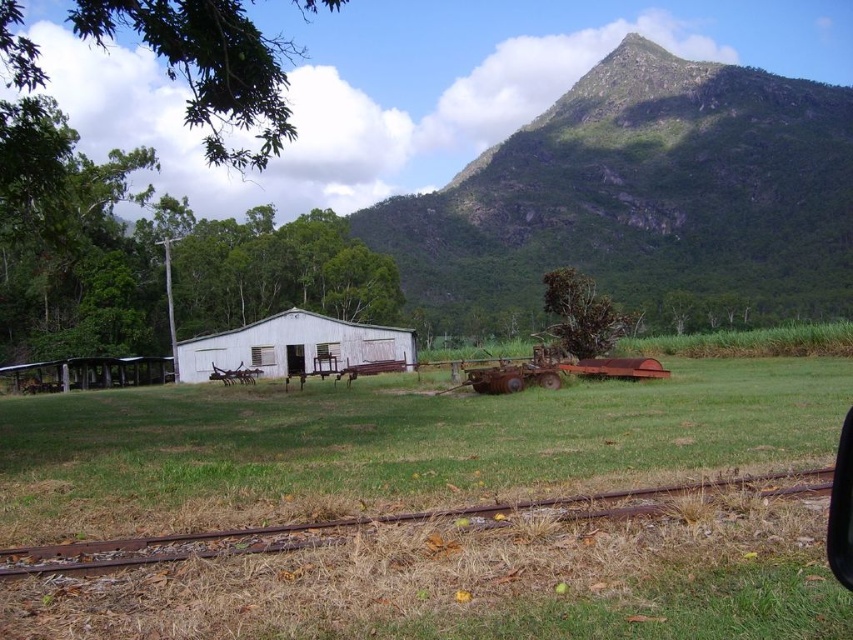
Question: Can you confirm if green rocky mountain at upper center is positioned to the right of transparent glass car window at lower right?

Choices:
 (A) yes
 (B) no

Answer: (A)

Question: Which point is closer to the camera?

Choices:
 (A) (839, 573)
 (B) (196, 353)
 (C) (775, 496)

Answer: (A)

Question: Considering the relative positions of green rocky mountain at upper center and transparent glass car window at lower right in the image provided, where is green rocky mountain at upper center located with respect to transparent glass car window at lower right?

Choices:
 (A) left
 (B) right

Answer: (B)

Question: Can you confirm if rusty metal train track at lower center is smaller than white matte barn at center?

Choices:
 (A) yes
 (B) no

Answer: (A)

Question: Estimate the real-world distances between objects in this image. Which object is farther from the rusty metal train track at lower center?

Choices:
 (A) green rocky mountain at upper center
 (B) transparent glass car window at lower right

Answer: (A)

Question: Based on their relative distances, which object is farther from the green rocky mountain at upper center?

Choices:
 (A) white matte barn at center
 (B) transparent glass car window at lower right
 (C) rusty metal train track at lower center

Answer: (B)